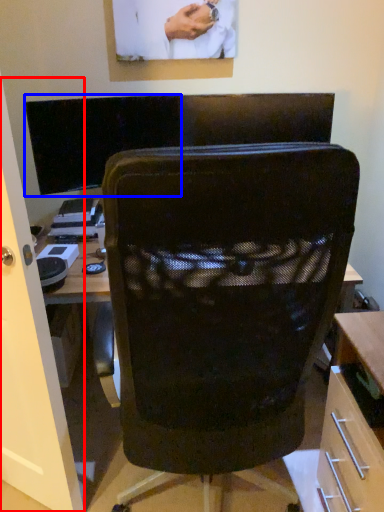
Question: Among these objects, which one is nearest to the camera, glass door (highlighted by a red box) or computer monitor (highlighted by a blue box)?

Choices:
 (A) glass door
 (B) computer monitor

Answer: (A)